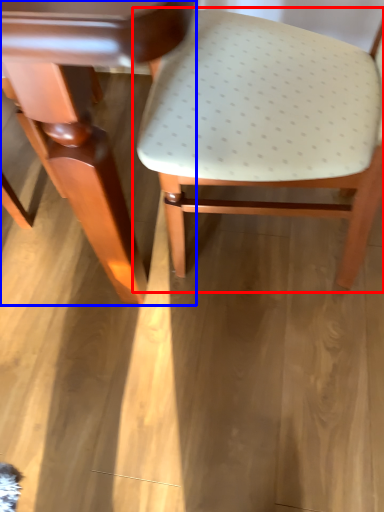
Question: Which object appears closest to the camera in this image, chair (highlighted by a red box) or table (highlighted by a blue box)?

Choices:
 (A) chair
 (B) table

Answer: (B)